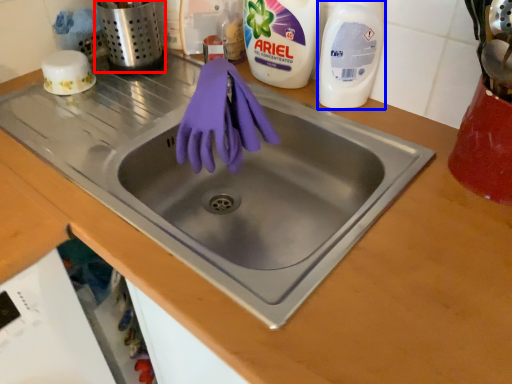
Question: Which object appears farthest to the camera in this image, appliance (highlighted by a red box) or cleaning product (highlighted by a blue box)?

Choices:
 (A) appliance
 (B) cleaning product

Answer: (A)